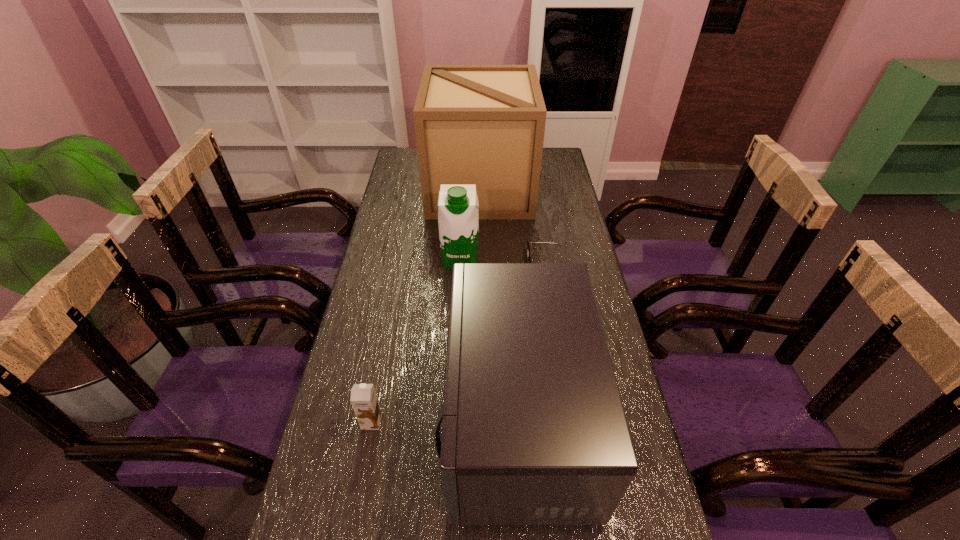
This screenshot has width=960, height=540. What are the coordinates of `microwave oven at the right edge` in the screenshot? It's located at (534, 432).

Find the location of a particular element. spectacles that is at the right edge is located at coordinates (528, 250).

Locate an element on the screen. object situated at the far left corner is located at coordinates (483, 125).

The image size is (960, 540). I want to click on object present at the far right corner, so click(x=483, y=125).

The height and width of the screenshot is (540, 960). I want to click on free location at the left edge of the desktop, so click(381, 263).

Locate an element on the screen. The height and width of the screenshot is (540, 960). vacant space at the right edge of the desktop is located at coordinates (580, 242).

The height and width of the screenshot is (540, 960). In order to click on free spot between the shortest object and the tallest object in this screenshot , I will do `click(513, 227)`.

Locate an element on the screen. This screenshot has width=960, height=540. the second closest object to the tallest object is located at coordinates (528, 250).

Identify which object is located as the third nearest to the leftmost object. Please provide its 2D coordinates. Your answer should be formatted as a tuple, i.e. [(x, y)], where the tuple contains the x and y coordinates of a point satisfying the conditions above.

[(528, 250)]

Find the location of `free space that satisfies the following two spatial constraints: 1. on the reinforced sides of the tallest object; 2. on the front-facing side of the soya milk`. free space that satisfies the following two spatial constraints: 1. on the reinforced sides of the tallest object; 2. on the front-facing side of the soya milk is located at coordinates (480, 259).